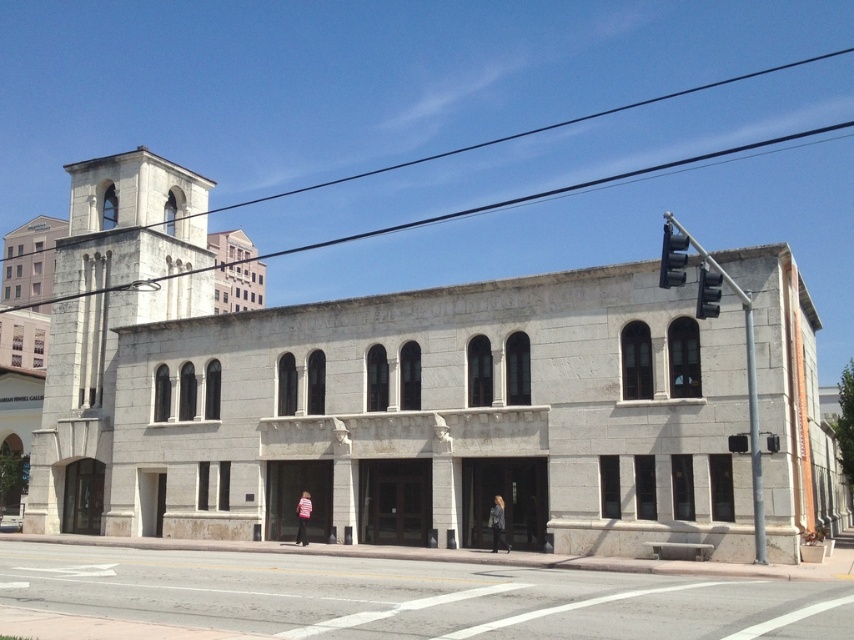
Question: Is gray concrete road at lower center above white stone tower at left?

Choices:
 (A) no
 (B) yes

Answer: (A)

Question: Which point is closer to the camera?

Choices:
 (A) (363, 588)
 (B) (92, 236)

Answer: (A)

Question: Observing the image, what is the correct spatial positioning of gray concrete road at lower center in reference to white stone tower at left?

Choices:
 (A) below
 (B) above

Answer: (A)

Question: Is gray stone church at center smaller than gray concrete road at lower center?

Choices:
 (A) no
 (B) yes

Answer: (A)

Question: Among these points, which one is farthest from the camera?

Choices:
 (A) (478, 380)
 (B) (539, 620)

Answer: (A)

Question: Which object is the farthest from the gray concrete road at lower center?

Choices:
 (A) gray stone church at center
 (B) white stone tower at left

Answer: (B)